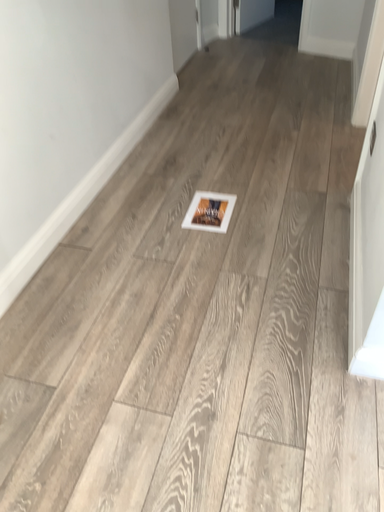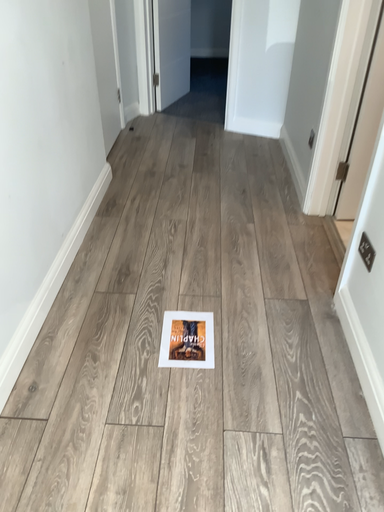
Question: Which way did the camera rotate in the video?

Choices:
 (A) rotated left
 (B) rotated right

Answer: (B)